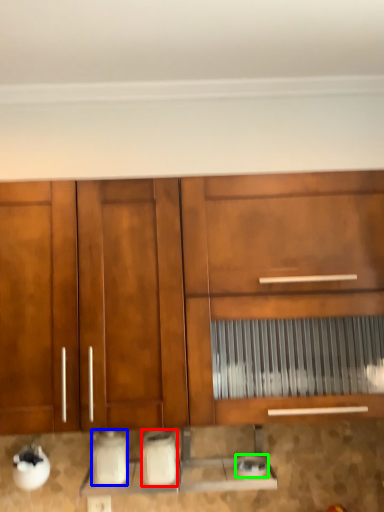
Question: Estimate the real-world distances between objects in this image. Which object is farther from appliance (highlighted by a red box), appliance (highlighted by a blue box) or appliance (highlighted by a green box)?

Choices:
 (A) appliance
 (B) appliance

Answer: (B)